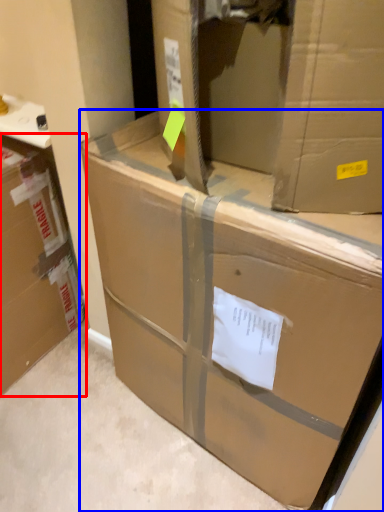
Question: Which object appears farthest to the camera in this image, box (highlighted by a red box) or box (highlighted by a blue box)?

Choices:
 (A) box
 (B) box

Answer: (A)